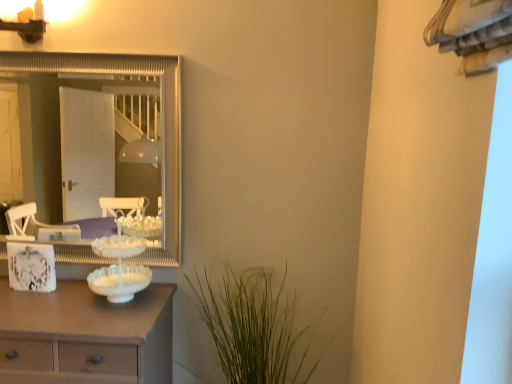
Measure the distance between green leafy plant at lower center and camera.

The depth of green leafy plant at lower center is 1.64 meters.

What is the approximate width of green leafy plant at lower center?

The width of green leafy plant at lower center is 20.43 inches.

This screenshot has height=384, width=512. I want to click on white wood chest of drawers at left, so click(86, 335).

The image size is (512, 384). What do you see at coordinates (119, 266) in the screenshot? I see `white frosted glass candle holder at center` at bounding box center [119, 266].

What is the approximate width of matte gold sconce at upper left?

matte gold sconce at upper left is 3.02 inches in width.

At what (x,y) coordinates should I click in order to perform the action: click on matte white picture frame at left. Please return your answer as a coordinate pair (x, y). The image size is (512, 384). Looking at the image, I should click on (31, 267).

Where is `green leafy plant at lower center`? The image size is (512, 384). green leafy plant at lower center is located at coordinates (253, 327).

In the scene shown: Does white frosted glass candle holder at center have a larger size compared to silver/metallic mirror at upper left?

No.

Which object is further away from the camera taking this photo, white frosted glass candle holder at center or silver/metallic mirror at upper left?

silver/metallic mirror at upper left.

From the image's perspective, is white frosted glass candle holder at center over silver/metallic mirror at upper left?

No, from the image's perspective, white frosted glass candle holder at center is not above silver/metallic mirror at upper left.

From the picture: Is white frosted glass candle holder at center taller than silver/metallic mirror at upper left?

No.

Is silver/metallic mirror at upper left at the left side of matte gold sconce at upper left?

No, silver/metallic mirror at upper left is not to the left of matte gold sconce at upper left.

Consider the image. Between silver/metallic mirror at upper left and matte gold sconce at upper left, which one has smaller width?

matte gold sconce at upper left.

Who is bigger, silver/metallic mirror at upper left or matte gold sconce at upper left?

silver/metallic mirror at upper left.

From a real-world perspective, relative to matte gold sconce at upper left, is silver/metallic mirror at upper left vertically above or below?

From a real-world perspective, silver/metallic mirror at upper left is physically below matte gold sconce at upper left.

Which point is more forward, (22,37) or (104,320)?

The point (104,320) is more forward.

From a real-world perspective, is matte gold sconce at upper left physically located above or below white wood chest of drawers at left?

In terms of real-world spatial position, matte gold sconce at upper left is above white wood chest of drawers at left.

Considering the sizes of objects matte gold sconce at upper left and white wood chest of drawers at left in the image provided, who is taller, matte gold sconce at upper left or white wood chest of drawers at left?

white wood chest of drawers at left.

Are matte gold sconce at upper left and white wood chest of drawers at left located far from each other?

Yes, matte gold sconce at upper left is far from white wood chest of drawers at left.

How many degrees apart are the facing directions of silver/metallic mirror at upper left and white frosted glass candle holder at center?

The facing directions of silver/metallic mirror at upper left and white frosted glass candle holder at center are 2.38 degrees apart.

Which of these two, silver/metallic mirror at upper left or white frosted glass candle holder at center, is wider?

white frosted glass candle holder at center is wider.

Considering the sizes of objects silver/metallic mirror at upper left and white frosted glass candle holder at center in the image provided, who is taller, silver/metallic mirror at upper left or white frosted glass candle holder at center?

silver/metallic mirror at upper left.

Considering the relative positions of green leafy plant at lower center and white wood chest of drawers at left in the image provided, is green leafy plant at lower center to the left of white wood chest of drawers at left from the viewer's perspective?

In fact, green leafy plant at lower center is to the right of white wood chest of drawers at left.

Is green leafy plant at lower center not near white wood chest of drawers at left?

No, green leafy plant at lower center is not far from white wood chest of drawers at left.

In order to click on chest of drawers below the green leafy plant at lower center (from a real-world perspective) in this screenshot , I will do `click(86, 335)`.

Looking at the image, does white wood chest of drawers at left seem bigger or smaller compared to white frosted glass candle holder at center?

In the image, white wood chest of drawers at left appears to be larger than white frosted glass candle holder at center.

Can you tell me how much white wood chest of drawers at left and white frosted glass candle holder at center differ in facing direction?

white wood chest of drawers at left and white frosted glass candle holder at center are facing 1.03 degrees away from each other.

Is white wood chest of drawers at left not within white frosted glass candle holder at center?

Indeed, white wood chest of drawers at left is completely outside white frosted glass candle holder at center.

This screenshot has height=384, width=512. What are the coordinates of `candle holder on the right side of white wood chest of drawers at left` in the screenshot? It's located at (119, 266).

From the image's perspective, is silver/metallic mirror at upper left located beneath green leafy plant at lower center?

Incorrect, from the image's perspective, silver/metallic mirror at upper left is higher than green leafy plant at lower center.

Is silver/metallic mirror at upper left closer to the viewer compared to green leafy plant at lower center?

No, silver/metallic mirror at upper left is further to the viewer.

Is silver/metallic mirror at upper left smaller than green leafy plant at lower center?

Yes.

This screenshot has width=512, height=384. I want to click on candle holder that is below the silver/metallic mirror at upper left (from the image's perspective), so click(119, 266).

This screenshot has width=512, height=384. Find the location of `mirror lying on the right of matte gold sconce at upper left`. mirror lying on the right of matte gold sconce at upper left is located at coordinates (45, 140).

From the image, which object appears to be nearer to white wood chest of drawers at left, white frosted glass candle holder at center or matte gold sconce at upper left?

The object closer to white wood chest of drawers at left is white frosted glass candle holder at center.

Estimate the real-world distances between objects in this image. Which object is further from white frosted glass candle holder at center, green leafy plant at lower center or matte white picture frame at left?

green leafy plant at lower center.

From the image, which object appears to be nearer to silver/metallic mirror at upper left, matte white picture frame at left or green leafy plant at lower center?

The object closer to silver/metallic mirror at upper left is matte white picture frame at left.

Which object lies further to the anchor point white frosted glass candle holder at center, matte gold sconce at upper left or green leafy plant at lower center?

matte gold sconce at upper left is positioned further to the anchor white frosted glass candle holder at center.

When comparing their distances from matte white picture frame at left, does silver/metallic mirror at upper left or white wood chest of drawers at left seem further?

silver/metallic mirror at upper left lies further to matte white picture frame at left than the other object.

Considering their positions, is silver/metallic mirror at upper left positioned closer to white frosted glass candle holder at center than green leafy plant at lower center?

The object closer to white frosted glass candle holder at center is green leafy plant at lower center.

When comparing their distances from green leafy plant at lower center, does white wood chest of drawers at left or silver/metallic mirror at upper left seem further?

silver/metallic mirror at upper left lies further to green leafy plant at lower center than the other object.

From the picture: From the image, which object appears to be nearer to matte gold sconce at upper left, silver/metallic mirror at upper left or green leafy plant at lower center?

green leafy plant at lower center lies closer to matte gold sconce at upper left than the other object.

Image resolution: width=512 pixels, height=384 pixels. I want to click on picture frame between white frosted glass candle holder at center and white wood chest of drawers at left in the vertical direction, so click(31, 267).

The image size is (512, 384). What are the coordinates of `candle holder situated between white wood chest of drawers at left and green leafy plant at lower center from left to right` in the screenshot? It's located at (119, 266).

Image resolution: width=512 pixels, height=384 pixels. In order to click on candle holder that lies between matte gold sconce at upper left and green leafy plant at lower center from top to bottom in this screenshot , I will do `click(119, 266)`.

Locate an element on the screen. The height and width of the screenshot is (384, 512). candle holder between matte gold sconce at upper left and matte white picture frame at left vertically is located at coordinates (119, 266).